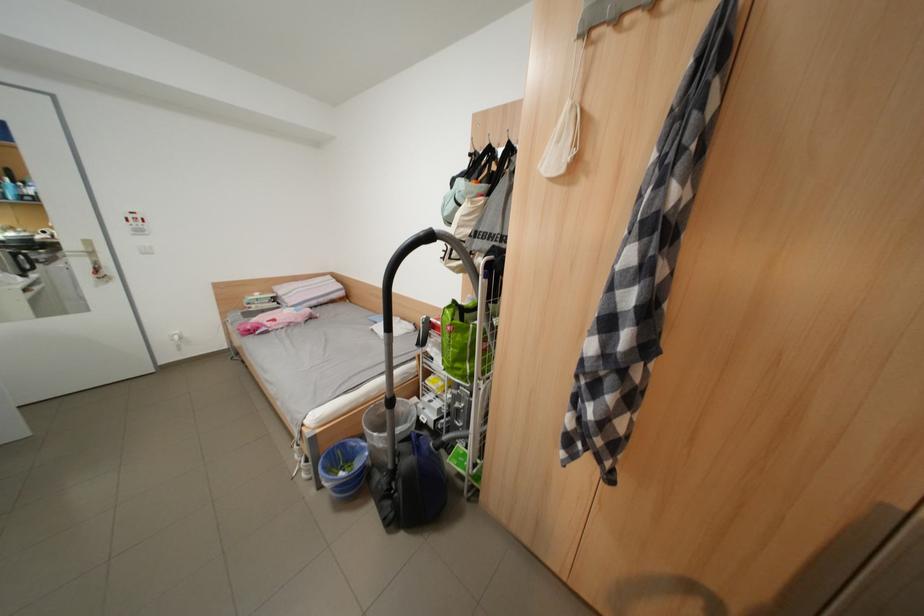
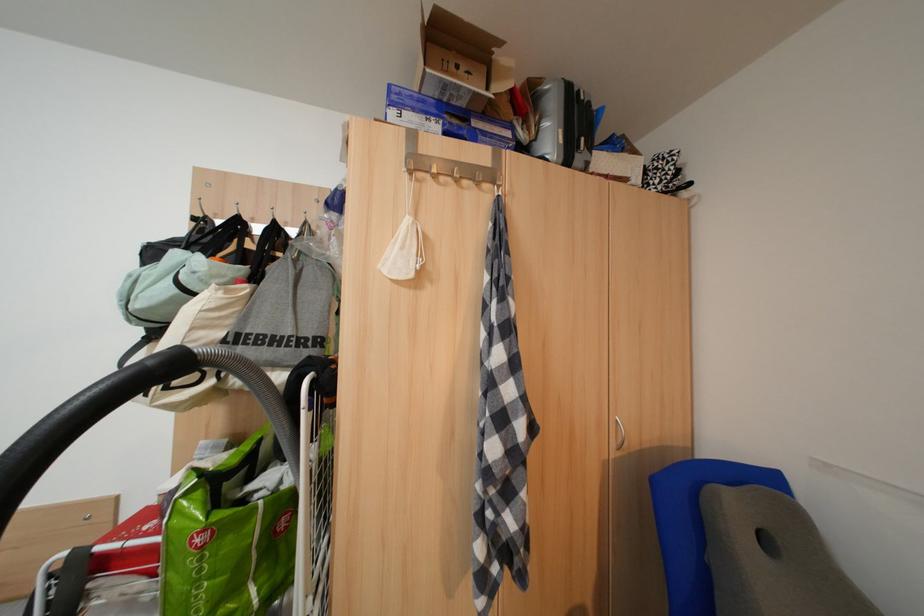
Where in the second image is the point corresponding to (x=500, y=241) from the first image?

(282, 346)